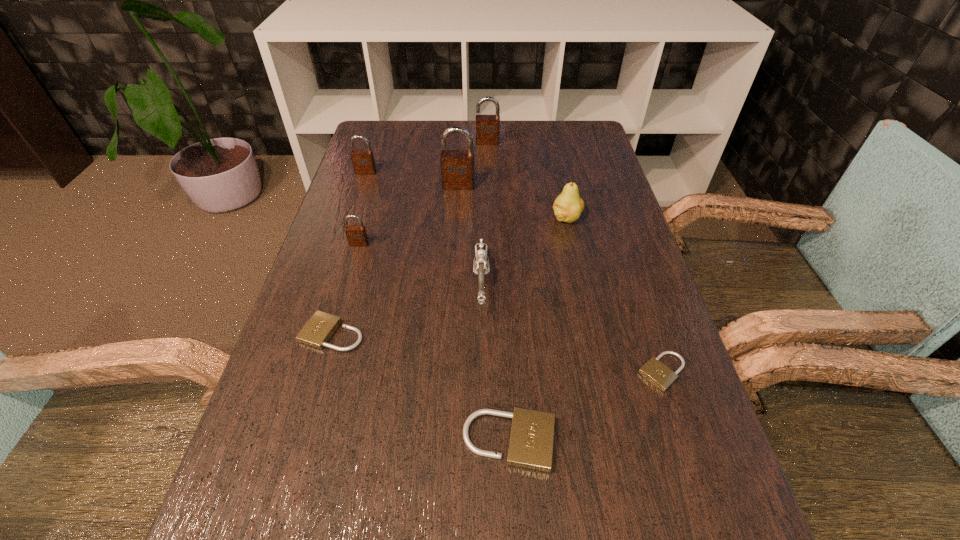
Identify the location of gun. The height and width of the screenshot is (540, 960). coord(481,262).

Locate an element on the screen. the biggest beige padlock is located at coordinates (531, 440).

In order to click on the nearest padlock in this screenshot , I will do `click(531, 440)`.

Image resolution: width=960 pixels, height=540 pixels. In order to click on the leftmost beige padlock in this screenshot , I will do `click(319, 329)`.

At what (x,y) coordinates should I click in order to perform the action: click on the second smallest beige padlock. Please return your answer as a coordinate pair (x, y). The image size is (960, 540). Looking at the image, I should click on (319, 329).

This screenshot has width=960, height=540. Identify the location of the smallest beige padlock. (654, 371).

At what (x,y) coordinates should I click in order to perform the action: click on the rightmost beige padlock. Please return your answer as a coordinate pair (x, y). Looking at the image, I should click on (654, 371).

Identify the location of vacant space situated on the front-facing side of the tallest padlock. (457, 212).

Where is `vacant space situated 0.360m on the front-facing side of the second tallest object`? vacant space situated 0.360m on the front-facing side of the second tallest object is located at coordinates (490, 215).

What are the coordinates of `vacant space situated 0.120m on the right of the pear` in the screenshot? It's located at (628, 218).